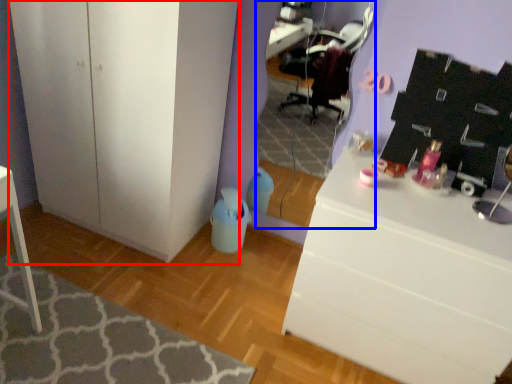
Question: Which of the following is the closest to the observer, cabinetry (highlighted by a red box) or mirror (highlighted by a blue box)?

Choices:
 (A) cabinetry
 (B) mirror

Answer: (A)